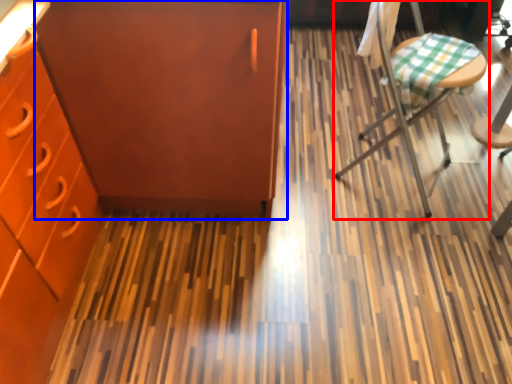
Question: Which of the following is the closest to the observer, chair (highlighted by a red box) or file cabinet (highlighted by a blue box)?

Choices:
 (A) chair
 (B) file cabinet

Answer: (B)